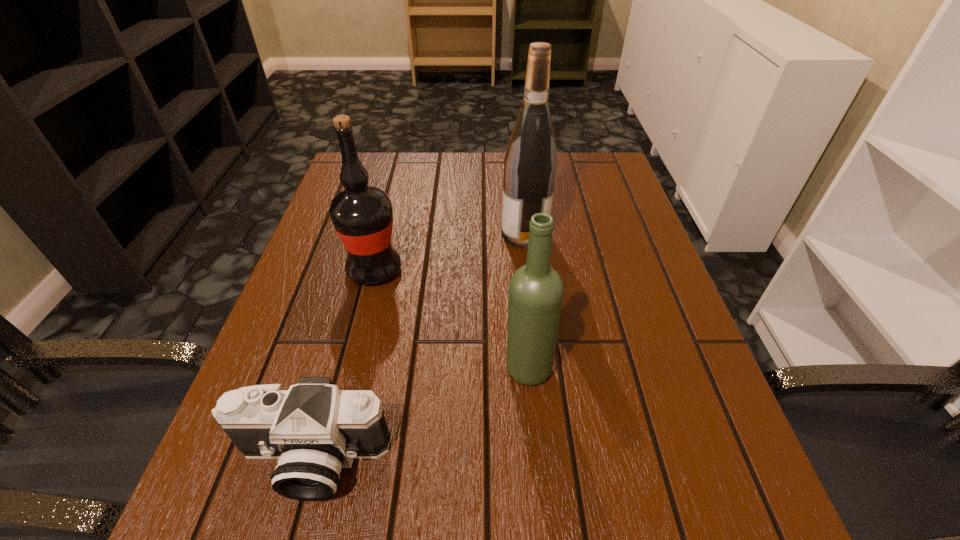
Find the location of a particular element. This screenshot has width=960, height=540. free space at the near right corner of the desktop is located at coordinates (695, 494).

Find the location of a particular element. Image resolution: width=960 pixels, height=540 pixels. free spot between the nearest object and the tallest wine bottle is located at coordinates (418, 346).

The image size is (960, 540). Find the location of `free space between the nearest wine bottle and the camera`. free space between the nearest wine bottle and the camera is located at coordinates (420, 414).

Locate an element on the screen. Image resolution: width=960 pixels, height=540 pixels. empty space between the second nearest wine bottle and the shortest object is located at coordinates (343, 364).

I want to click on vacant area that lies between the third farthest object and the leftmost wine bottle, so pos(451,319).

The image size is (960, 540). I want to click on free space between the second nearest wine bottle and the camera, so click(343, 364).

I want to click on empty location between the leftmost wine bottle and the nearest wine bottle, so click(x=451, y=319).

Locate an element on the screen. free spot between the second farthest object and the nearest wine bottle is located at coordinates (451, 319).

The image size is (960, 540). In order to click on unoccupied area between the leftmost wine bottle and the nearest object in this screenshot , I will do `click(343, 364)`.

What are the coordinates of `vacant area that lies between the farthest object and the leftmost wine bottle` in the screenshot? It's located at (449, 252).